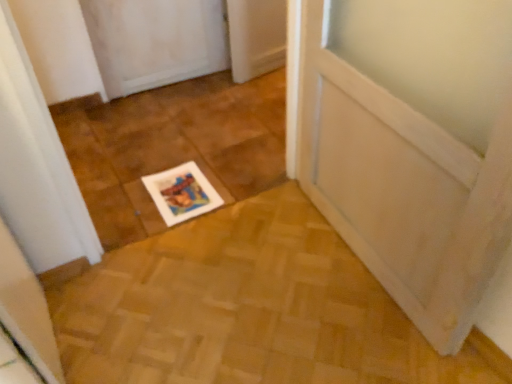
What do you see at coordinates (182, 193) in the screenshot? The image size is (512, 384). I see `white paper at center` at bounding box center [182, 193].

Locate an element on the screen. This screenshot has height=384, width=512. white paper at center is located at coordinates (182, 193).

The image size is (512, 384). Find the location of `white paper at center`. white paper at center is located at coordinates (182, 193).